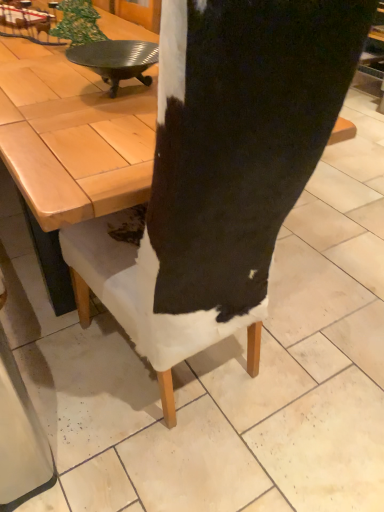
The height and width of the screenshot is (512, 384). Describe the element at coordinates (116, 60) in the screenshot. I see `metallic silver plate at upper left` at that location.

You are a GUI agent. You are given a task and a screenshot of the screen. Output one action in this format:
    pyautogui.click(x=<x>, y=<y>)
    Task: Click on the metallic silver plate at upper left
    This screenshot has height=512, width=384.
    Given the screenshot: What is the action you would take?
    pyautogui.click(x=116, y=60)

Measure the distance between point (x=133, y=68) and camera.

1.30 meters.

Where is `wooden at center`? wooden at center is located at coordinates (70, 148).

Describe the element at coordinates (70, 148) in the screenshot. This screenshot has width=384, height=512. I see `wooden at center` at that location.

At what (x,y) coordinates should I click in order to perform the action: click on metallic silver plate at upper left. Please return your answer as a coordinate pair (x, y). Image resolution: width=384 pixels, height=512 pixels. Looking at the image, I should click on [116, 60].

Between wooden at center and metallic silver plate at upper left, which one appears on the left side from the viewer's perspective?

Positioned to the left is wooden at center.

Is the depth of wooden at center greater than that of metallic silver plate at upper left?

No, it is in front of metallic silver plate at upper left.

Is point (26, 56) farther from viewer compared to point (139, 51)?

Yes, it is.

From the image's perspective, does wooden at center appear lower than metallic silver plate at upper left?

Actually, wooden at center appears above metallic silver plate at upper left in the image.

From a real-world perspective, which is physically above, wooden at center or metallic silver plate at upper left?

In real-world perspective, metallic silver plate at upper left is above.

Is wooden at center wider or thinner than metallic silver plate at upper left?

wooden at center is wider than metallic silver plate at upper left.

Considering the sizes of objects wooden at center and metallic silver plate at upper left in the image provided, who is shorter, wooden at center or metallic silver plate at upper left?

With less height is metallic silver plate at upper left.

Can you confirm if wooden at center is bigger than metallic silver plate at upper left?

Correct, wooden at center is larger in size than metallic silver plate at upper left.

Is wooden at center positioned beyond the bounds of metallic silver plate at upper left?

wooden at center lies outside metallic silver plate at upper left's area.

In the scene shown: Is wooden at center far from metallic silver plate at upper left?

wooden at center is near metallic silver plate at upper left, not far away.

Could you tell me if wooden at center is turned towards metallic silver plate at upper left?

No, wooden at center is not turned towards metallic silver plate at upper left.

How different are the orientations of wooden at center and metallic silver plate at upper left in degrees?

The facing directions of wooden at center and metallic silver plate at upper left are 1.93 degrees apart.

Measure the distance from wooden at center to metallic silver plate at upper left.

A distance of 6.74 inches exists between wooden at center and metallic silver plate at upper left.

Identify the location of coffee table located in front of the metallic silver plate at upper left. This screenshot has width=384, height=512. (70, 148).

Which is more to the left, metallic silver plate at upper left or wooden at center?

wooden at center is more to the left.

Is metallic silver plate at upper left closer to camera compared to wooden at center?

No, metallic silver plate at upper left is behind wooden at center.

Is point (129, 65) behind point (3, 53)?

No, (129, 65) is closer to viewer.

From the image's perspective, between metallic silver plate at upper left and wooden at center, which one is located above?

wooden at center is shown above in the image.

From a real-world perspective, who is located higher, metallic silver plate at upper left or wooden at center?

From a 3D spatial view, metallic silver plate at upper left is above.

Between metallic silver plate at upper left and wooden at center, which one has larger width?

wooden at center.

Considering the relative sizes of metallic silver plate at upper left and wooden at center in the image provided, is metallic silver plate at upper left taller than wooden at center?

No.

Looking at this image, can you confirm if metallic silver plate at upper left is smaller than wooden at center?

Yes, metallic silver plate at upper left is smaller than wooden at center.

Is wooden at center a part of metallic silver plate at upper left?

No, wooden at center is located outside of metallic silver plate at upper left.

Is metallic silver plate at upper left next to wooden at center?

They are not placed beside each other.

Is metallic silver plate at upper left oriented away from wooden at center?

metallic silver plate at upper left is not turned away from wooden at center.

How different are the orientations of metallic silver plate at upper left and wooden at center in degrees?

The angular difference between metallic silver plate at upper left and wooden at center is 1.93 degrees.

Measure the distance between metallic silver plate at upper left and wooden at center.

They are 6.74 inches apart.

This screenshot has width=384, height=512. I want to click on round table below the wooden at center (from the image's perspective), so click(116, 60).

Find the location of `coffee table lying on the left of metallic silver plate at upper left`. coffee table lying on the left of metallic silver plate at upper left is located at coordinates (70, 148).

The width and height of the screenshot is (384, 512). In order to click on coffee table in front of the metallic silver plate at upper left in this screenshot , I will do `click(70, 148)`.